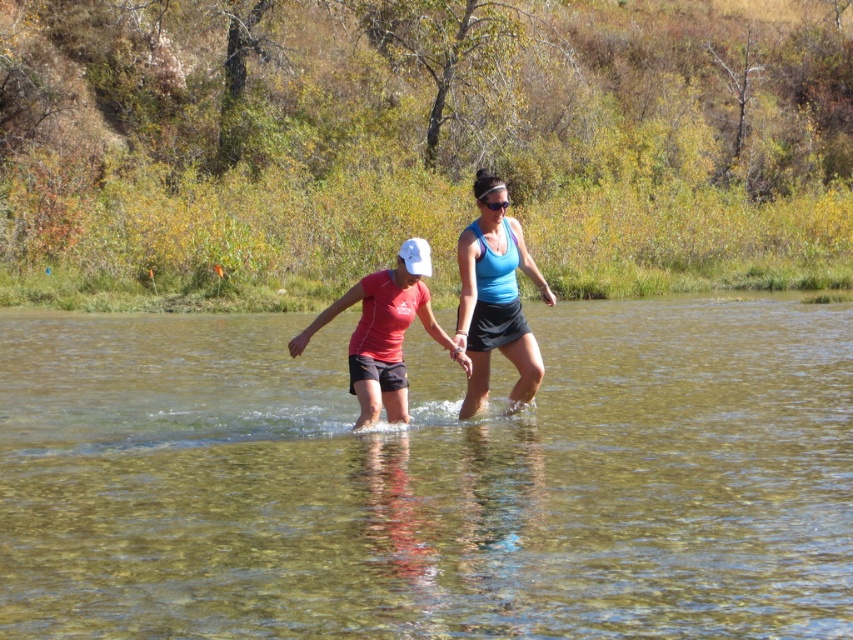
Is clear water at center to the right of matte red shirt at center from the viewer's perspective?

No, clear water at center is not to the right of matte red shirt at center.

Locate an element on the screen. Image resolution: width=853 pixels, height=640 pixels. clear water at center is located at coordinates (428, 481).

Does clear water at center appear under blue matte tank top at center?

Yes, clear water at center is below blue matte tank top at center.

Can you confirm if clear water at center is positioned above blue matte tank top at center?

No, clear water at center is not above blue matte tank top at center.

Who is more distant from viewer, (576,470) or (486,182)?

The point (486,182) is more distant.

In order to click on clear water at center in this screenshot , I will do `click(428, 481)`.

The width and height of the screenshot is (853, 640). Describe the element at coordinates (491, 300) in the screenshot. I see `matte red shirt at center` at that location.

Can you confirm if matte red shirt at center is taller than blue matte tank top at center?

Indeed, matte red shirt at center has a greater height compared to blue matte tank top at center.

Identify the location of matte red shirt at center. The height and width of the screenshot is (640, 853). (491, 300).